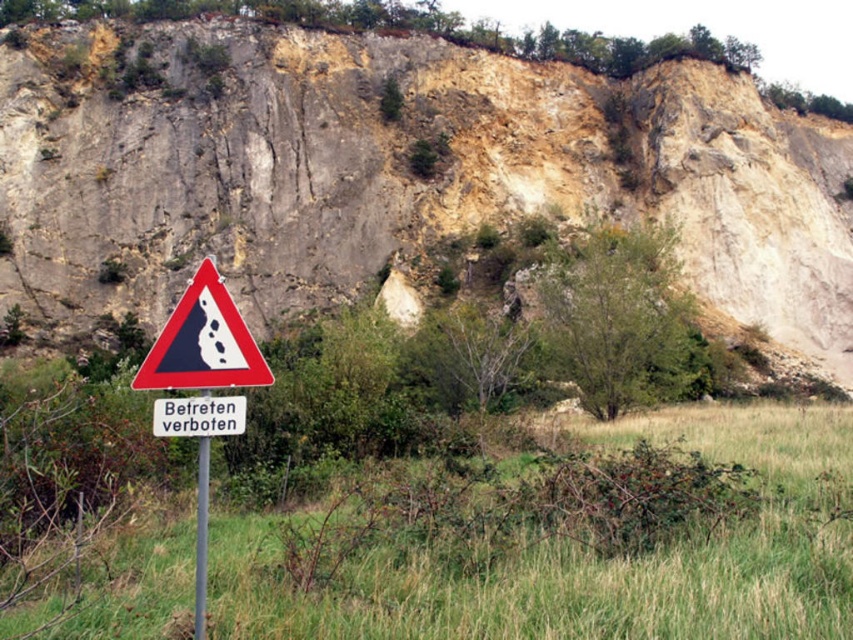
Question: Which point is farther to the camera?

Choices:
 (A) white plastic sign at center
 (B) red triangle warning sign at lower left
 (C) black glossy triangle at center

Answer: (C)

Question: Can you confirm if rough stone cliff at upper center is wider than black glossy triangle at center?

Choices:
 (A) no
 (B) yes

Answer: (B)

Question: Can you confirm if rough stone cliff at upper center is thinner than white plastic sign at center?

Choices:
 (A) yes
 (B) no

Answer: (B)

Question: Which of the following is the farthest from the observer?

Choices:
 (A) (199, 349)
 (B) (48, 294)
 (C) (196, 326)
 (D) (161, 404)

Answer: (B)

Question: Which object appears farthest from the camera in this image?

Choices:
 (A) brushed metal pole at lower center
 (B) white plastic sign at center

Answer: (B)

Question: Is black glossy triangle at center thinner than white plastic sign at center?

Choices:
 (A) no
 (B) yes

Answer: (A)